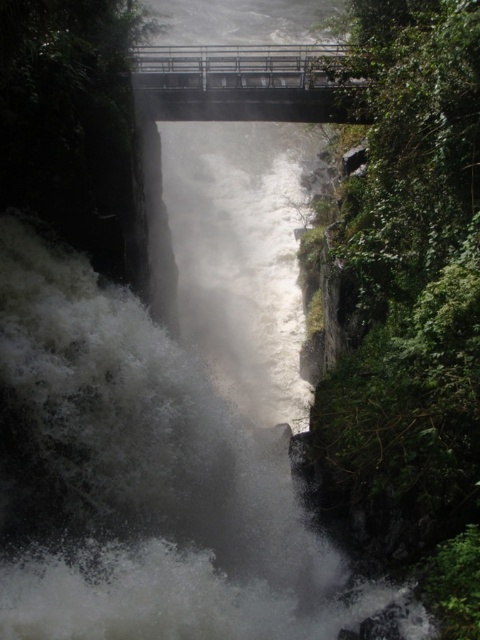
You are a hiker who wants to cross the gorge using the bridge. However, you notice the white frothy water at center and the metallic bridge at upper center. Based on their positions, can you determine if the bridge is above or below the waterfall?

The white frothy water at center is in front of the metallic bridge at upper center, which means the bridge is above the waterfall.

You are a hiker standing on the metallic bridge at upper center. You want to cross to the other side. Can you see the white frothy water at center from where you are standing?

Yes, the white frothy water at center is positioned under the metallic bridge at upper center, so you can see it from the bridge.